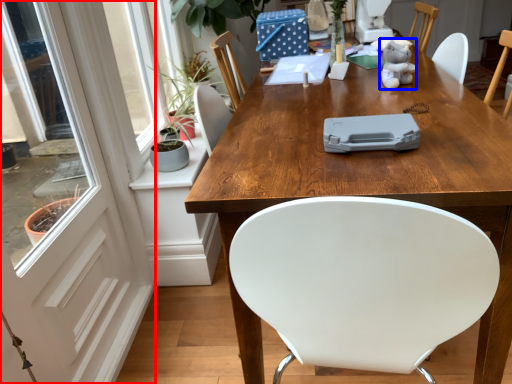
Question: Which object is closer to the camera taking this photo, screen door (highlighted by a red box) or toy (highlighted by a blue box)?

Choices:
 (A) screen door
 (B) toy

Answer: (A)